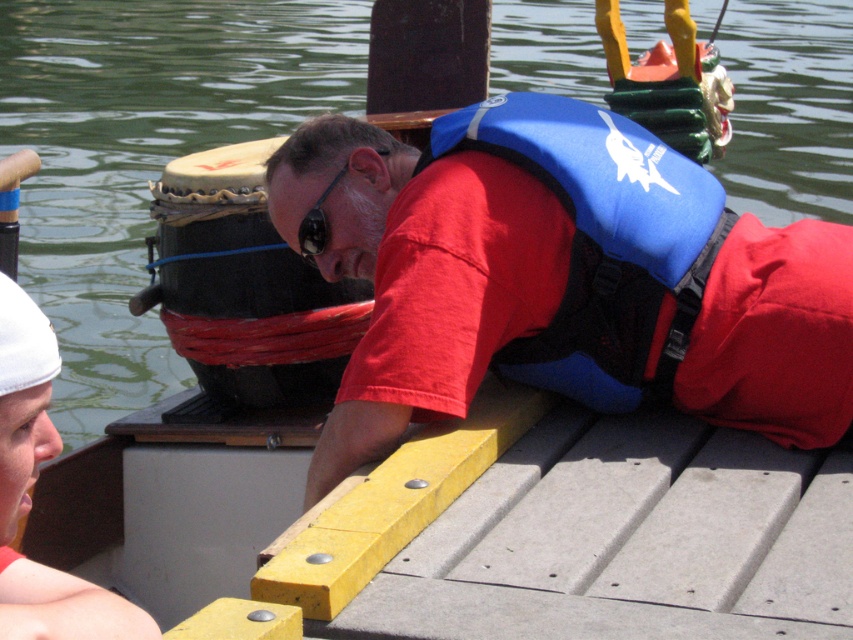
Based on the scene description, where is the blue neoprene life vest at center located in terms of coordinates?

The blue neoprene life vest at center is located at coordinates point (602, 241).